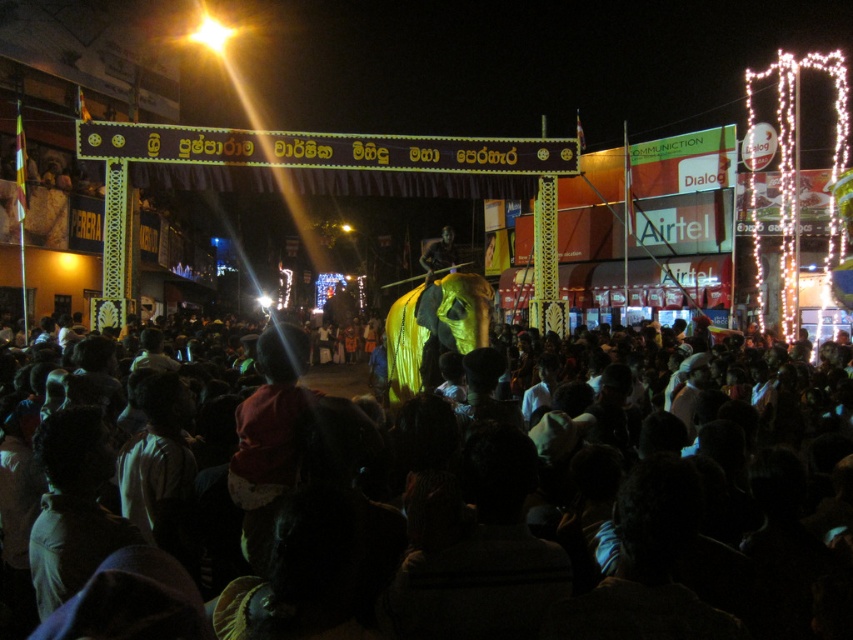
Question: Considering the relative positions of dark brown hair at center and dark textured figure at center in the image provided, where is dark brown hair at center located with respect to dark textured figure at center?

Choices:
 (A) below
 (B) above

Answer: (A)

Question: Which point is farther to the camera?

Choices:
 (A) (561, 451)
 (B) (451, 259)

Answer: (B)

Question: Is dark brown hair at center to the right of dark textured figure at center from the viewer's perspective?

Choices:
 (A) no
 (B) yes

Answer: (B)

Question: Which object appears farthest from the camera in this image?

Choices:
 (A) dark textured figure at center
 (B) dark brown hair at center

Answer: (A)

Question: Does dark brown hair at center appear on the left side of dark textured figure at center?

Choices:
 (A) no
 (B) yes

Answer: (A)